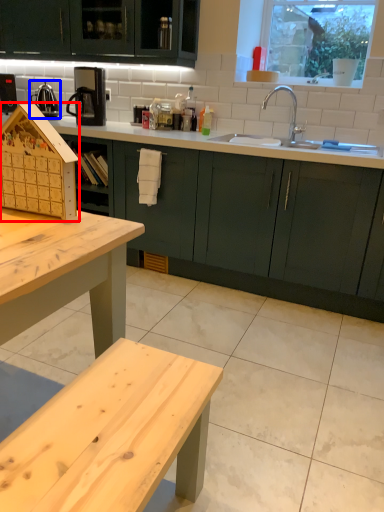
Question: Which of the following is the closest to the observer, appliance (highlighted by a red box) or tea pot (highlighted by a blue box)?

Choices:
 (A) appliance
 (B) tea pot

Answer: (A)